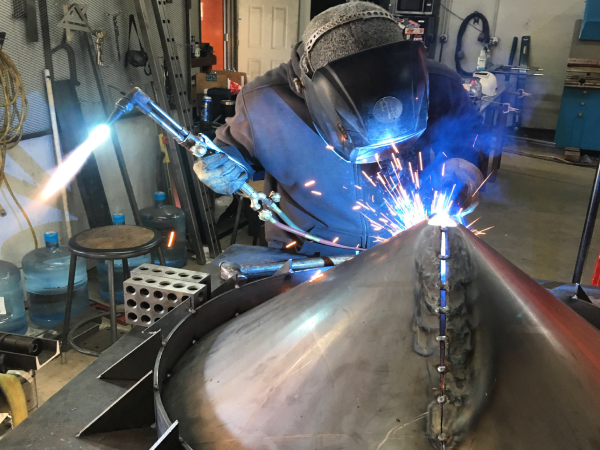
Identify the location of cabinet drawers. (578, 114), (583, 96), (583, 273), (581, 105).